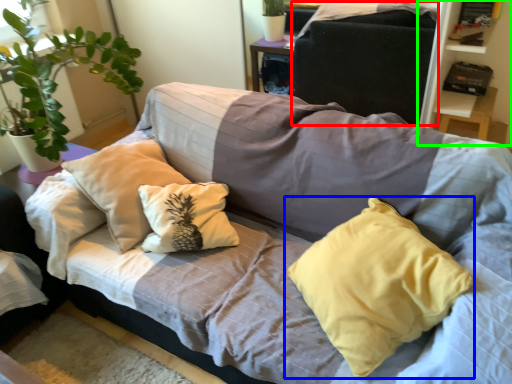
Question: Considering the real-world distances, which object is closest to gray (highlighted by a red box)? pillow (highlighted by a blue box) or bookshelf (highlighted by a green box).

Choices:
 (A) pillow
 (B) bookshelf

Answer: (B)